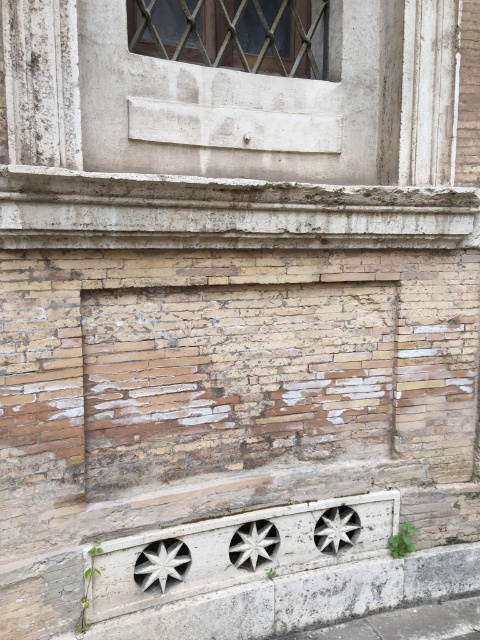
You are a delivery person trying to park your 1.2 meter wide cart in front of the building. The parking space is between the white concrete curb at lower center and the metallic gridwork window at upper center. Can your cart fit in the space between them?

The white concrete curb at lower center might be wider than the metallic gridwork window at upper center, so the space between them could accommodate the 1.2 meter wide cart. However, since the exact width isn

From the picture: You are a delivery person trying to park your bike. You see the white concrete curb at lower center and the gray concrete pavement at lower center. Which surface is larger and more suitable for parking your bike?

The white concrete curb at lower center is bigger than the gray concrete pavement at lower center, so it is more suitable for parking your bike.

You are a delivery person trying to park your 2.5 meter long cart between the white concrete curb at lower center and the metallic gridwork window at upper center. Can you fit your cart in that space?

The distance between the white concrete curb at lower center and the metallic gridwork window at upper center is 3.46 meters, which is longer than your 2.5 meter cart. Therefore, you can park your cart in that space.